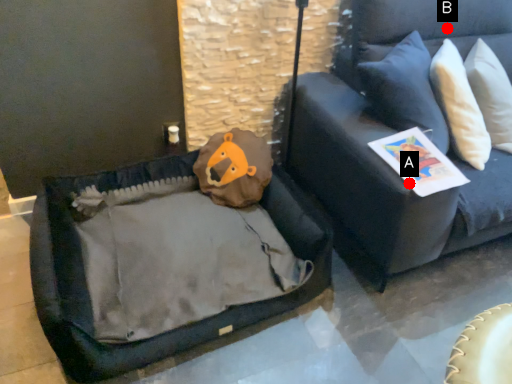
Question: Two points are circled on the image, labeled by A and B beside each circle. Which of the following is the closest to the observer?

Choices:
 (A) A is closer
 (B) B is closer

Answer: (A)